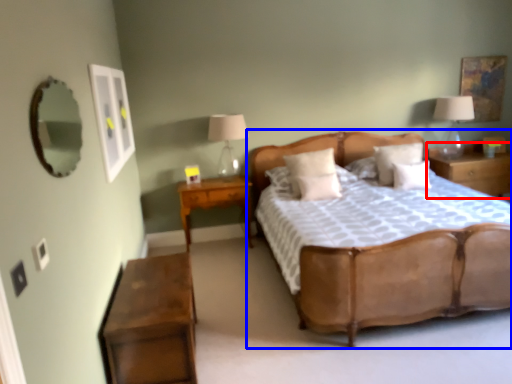
Question: Which of the following is the farthest to the observer, nightstand (highlighted by a red box) or bed (highlighted by a blue box)?

Choices:
 (A) nightstand
 (B) bed

Answer: (A)